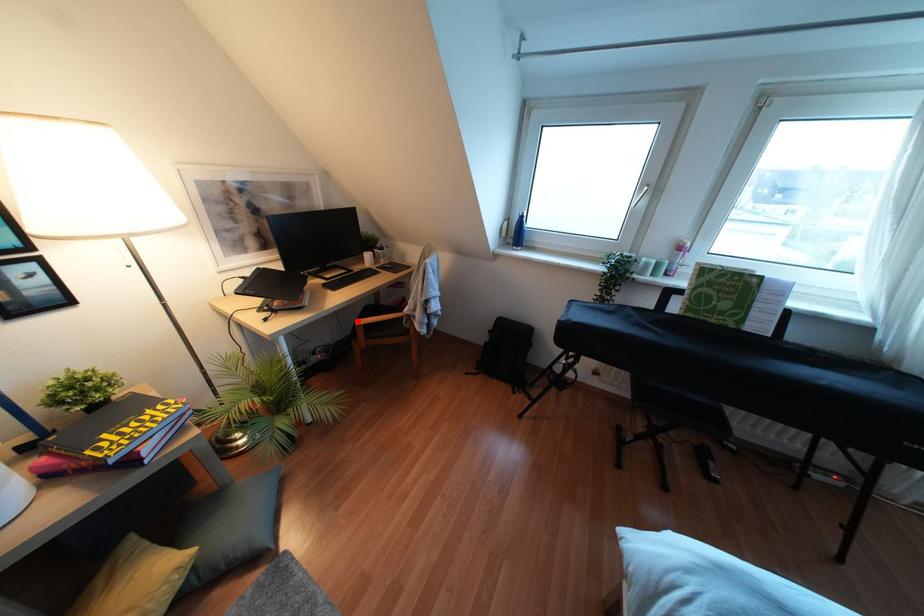
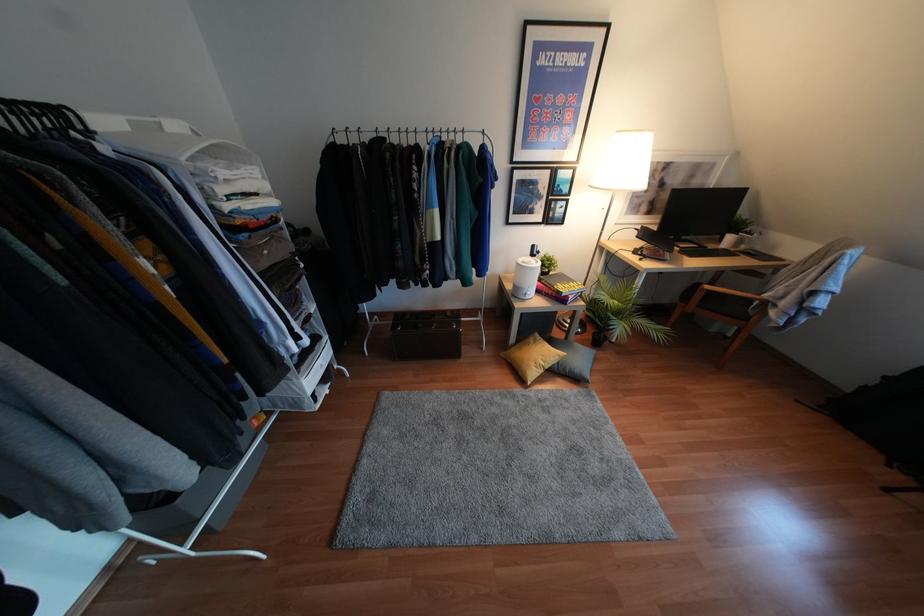
Find the pixel in the second image that matches the highlighted location in the first image.

(707, 286)